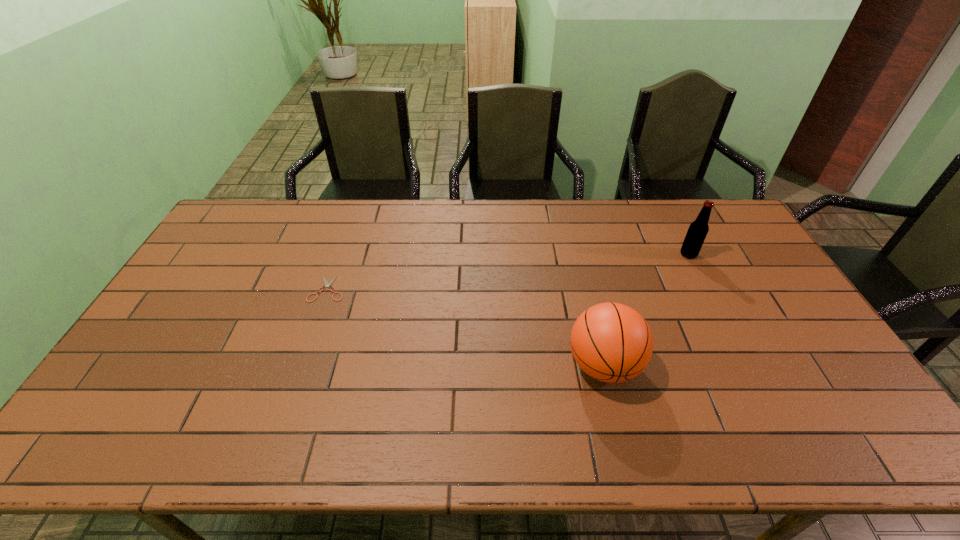
Identify the location of free space at the near edge. Image resolution: width=960 pixels, height=540 pixels. pos(583,445).

Find the location of `free space at the left edge`. free space at the left edge is located at coordinates (117, 415).

At what (x,y) coordinates should I click in order to perform the action: click on vacant space at the right edge of the desktop. Please return your answer as a coordinate pair (x, y). Looking at the image, I should click on (750, 296).

Identify the location of vacant space at the near right corner. (842, 438).

Where is `free space between the rightmost object and the second object from right to left`? free space between the rightmost object and the second object from right to left is located at coordinates (646, 310).

Locate an element on the screen. Image resolution: width=960 pixels, height=540 pixels. free space between the farthest object and the basketball is located at coordinates (646, 310).

You are a GUI agent. You are given a task and a screenshot of the screen. Output one action in this format:
    pyautogui.click(x=<x>, y=<y>)
    Task: Click on the empty space that is in between the shortest object and the rightmost object
    
    Given the screenshot: What is the action you would take?
    pyautogui.click(x=508, y=272)

Locate an element on the screen. This screenshot has width=960, height=540. free area in between the second nearest object and the nearest object is located at coordinates (466, 327).

Where is `empty location between the second object from left to right and the beer bottle`? This screenshot has height=540, width=960. empty location between the second object from left to right and the beer bottle is located at coordinates (646, 310).

The width and height of the screenshot is (960, 540). In order to click on unoccupied area between the nearest object and the shears in this screenshot , I will do `click(466, 327)`.